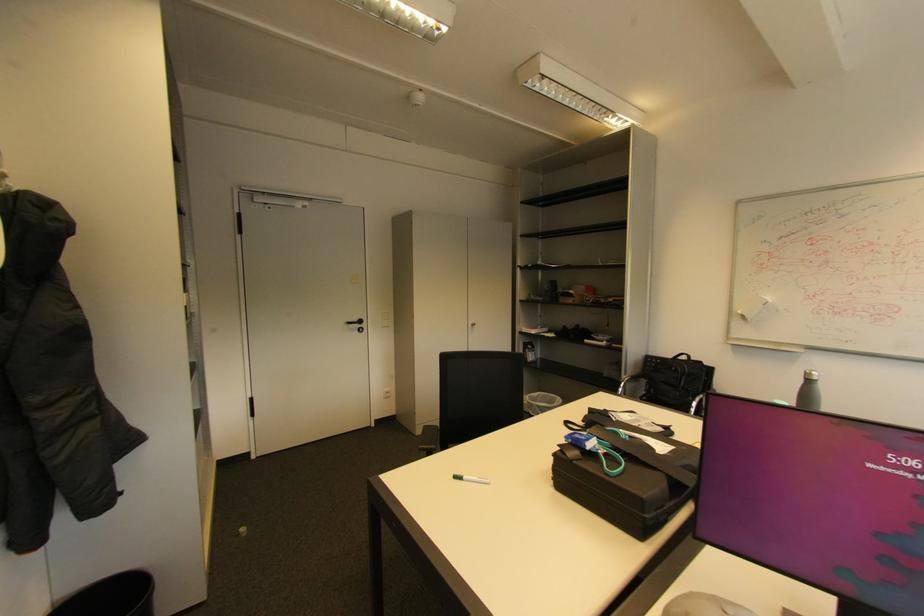
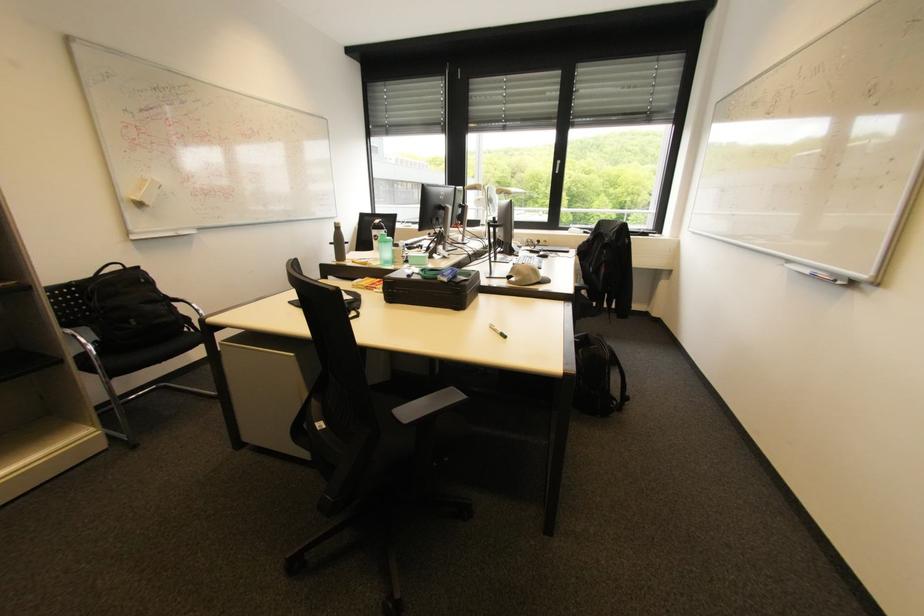
Locate, in the second image, the point that corresponds to [678,369] in the first image.

(148, 281)